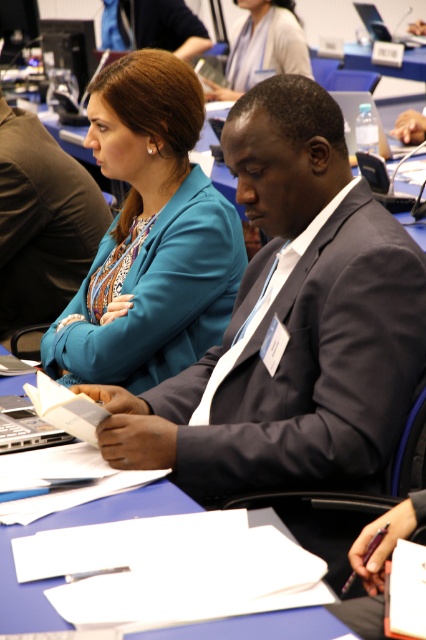
Can you confirm if teal fabric jacket at upper center is bigger than matte black suit at center?

Yes.

What do you see at coordinates (152, 237) in the screenshot? The image size is (426, 640). I see `teal fabric jacket at upper center` at bounding box center [152, 237].

Which is in front, point (198, 330) or point (29, 307)?

Point (198, 330)

Where is `teal fabric jacket at upper center`? This screenshot has height=640, width=426. teal fabric jacket at upper center is located at coordinates (152, 237).

Is the position of teal fabric jacket at upper center less distant than that of silver metallic laptop at upper right?

Yes, it is.

Does teal fabric jacket at upper center have a lesser width compared to silver metallic laptop at upper right?

Yes.

Is point (63, 332) positioned in front of point (367, 4)?

Yes, it is in front of point (367, 4).

At what (x,y) coordinates should I click in order to perform the action: click on teal fabric jacket at upper center. Please return your answer as a coordinate pair (x, y). This screenshot has width=426, height=640. Looking at the image, I should click on [152, 237].

Between teal fabric jacket at upper center and matte blue blazer at upper center, which one has less height?

matte blue blazer at upper center is shorter.

Image resolution: width=426 pixels, height=640 pixels. What are the coordinates of `teal fabric jacket at upper center` in the screenshot? It's located at (152, 237).

Find the location of `teal fabric jacket at upper center`. teal fabric jacket at upper center is located at coordinates (152, 237).